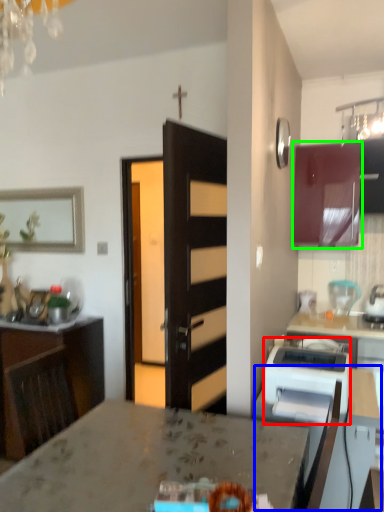
Question: Which is farther away from appliance (highlighted by a red box)? table (highlighted by a blue box) or cabinetry (highlighted by a green box)?

Choices:
 (A) table
 (B) cabinetry

Answer: (B)